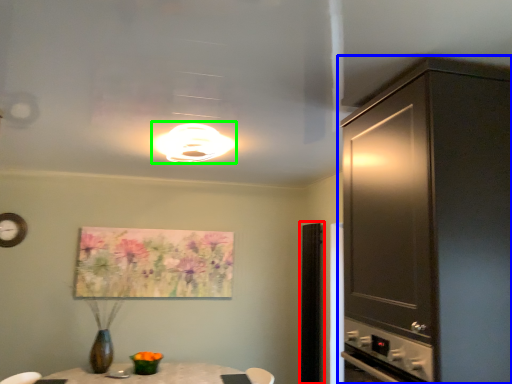
Question: Which object is positioned closest to glass door (highlighted by a red box)? Select from cabinetry (highlighted by a blue box) and light fixture (highlighted by a green box).

Choices:
 (A) cabinetry
 (B) light fixture

Answer: (B)